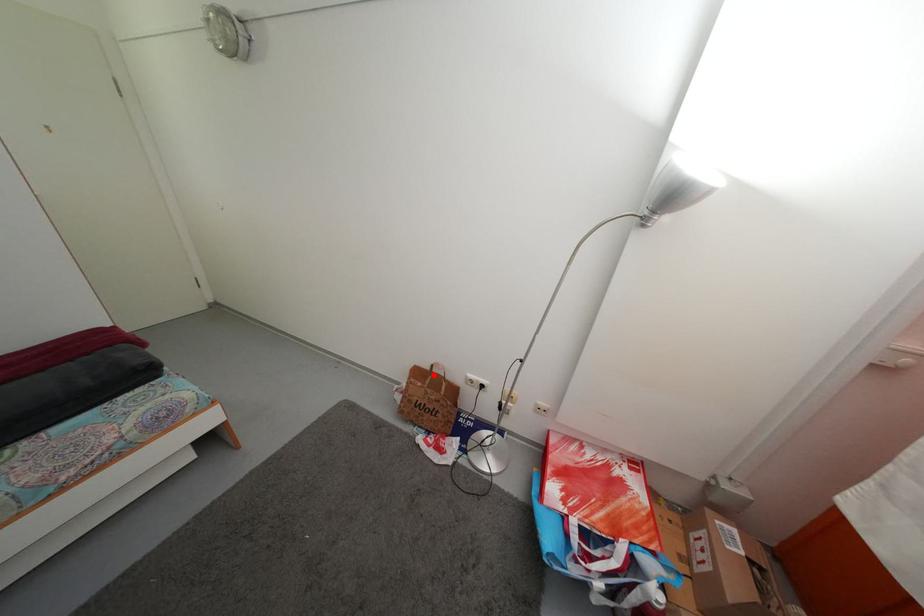
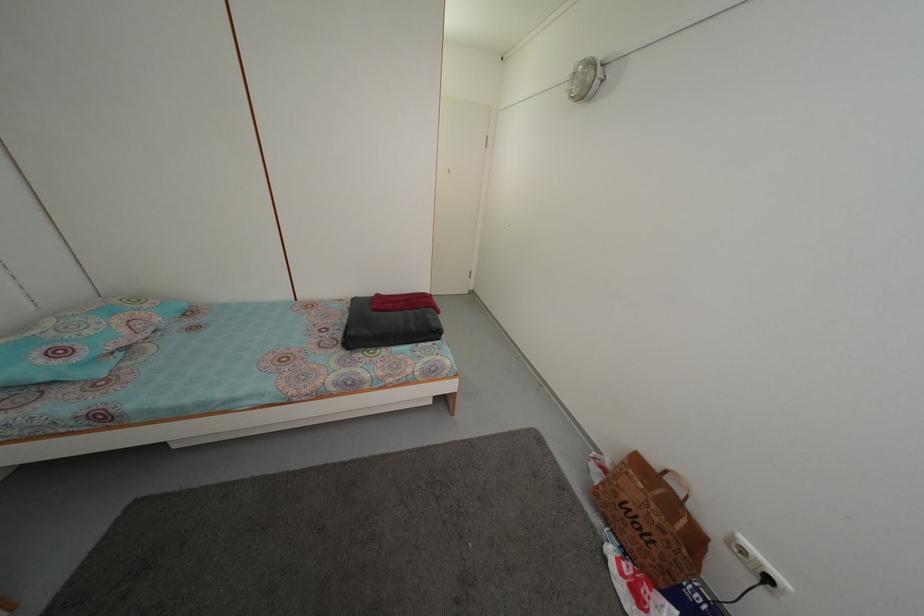
The point at the highlighted location is marked in the first image. Where is the corresponding point in the second image?

(662, 475)